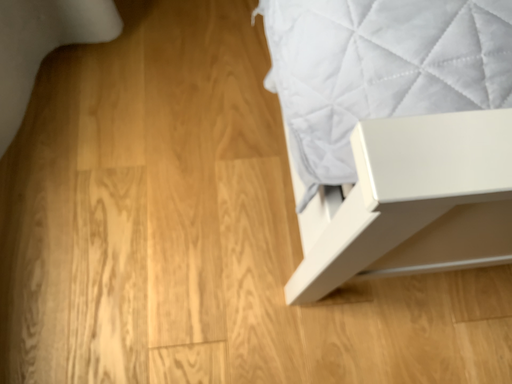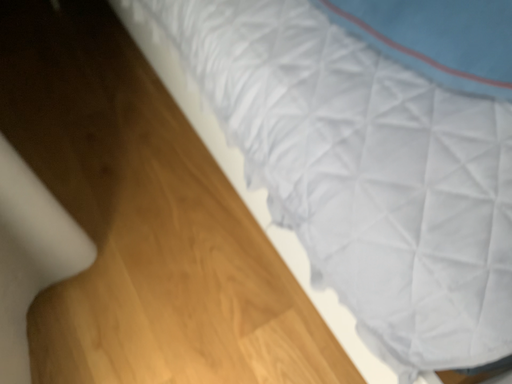
Question: How did the camera likely rotate when shooting the video?

Choices:
 (A) rotated right
 (B) rotated left

Answer: (A)